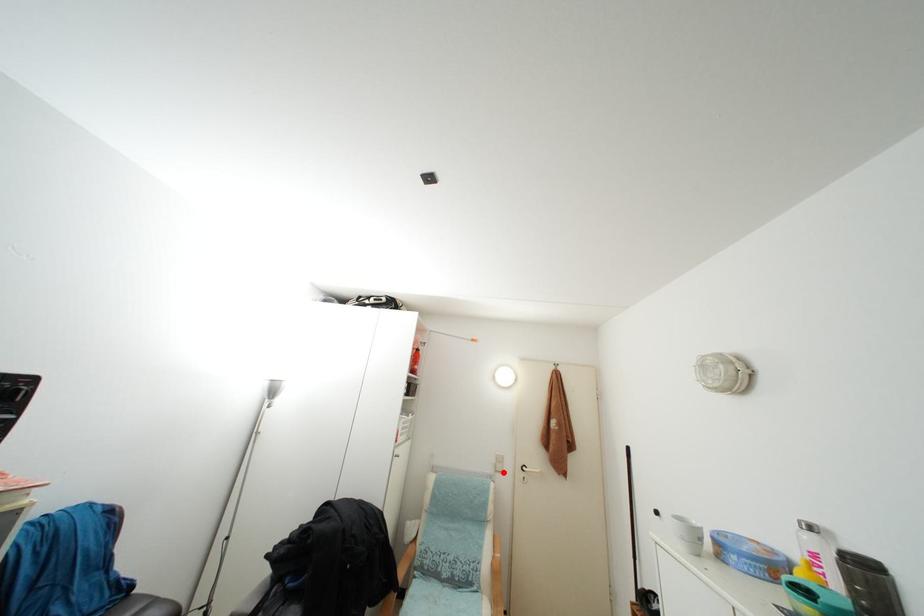
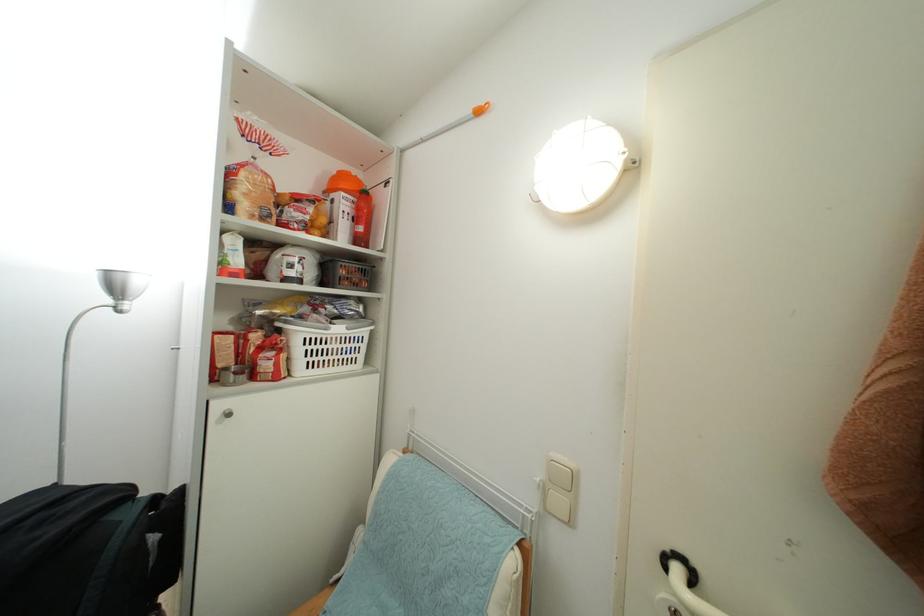
The point at the highlighted location is marked in the first image. Where is the corresponding point in the second image?

(563, 507)